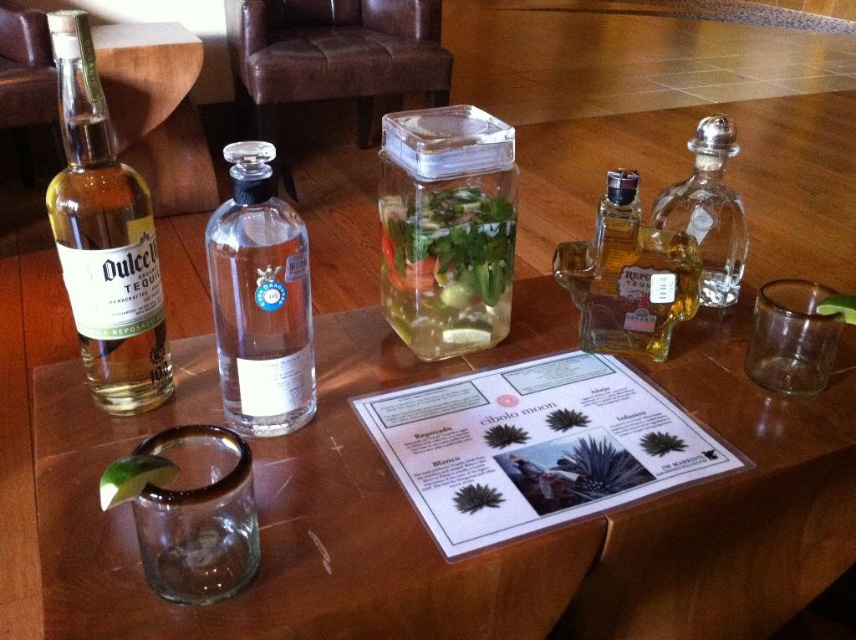
Question: Can you confirm if clear glass container at center is positioned to the left of clear glass bottle at upper right?

Choices:
 (A) yes
 (B) no

Answer: (A)

Question: Which is nearer to the clear glass bottle at center?

Choices:
 (A) clear glass bottle at upper right
 (B) translucent glass tequila bottle at center-right

Answer: (B)

Question: Which of the following is the closest to the observer?

Choices:
 (A) clear glass bottle at center
 (B) clear glass bottle at upper right
 (C) clear glass menu at center

Answer: (C)

Question: Which is farther from the clear glass container at center?

Choices:
 (A) translucent glass tequila bottle at center-right
 (B) clear glass bottle at upper right

Answer: (B)

Question: Is translucent glass tequila bottle at center-right to the left of clear glass bottle at upper right from the viewer's perspective?

Choices:
 (A) no
 (B) yes

Answer: (B)

Question: Is clear glass container at center to the left of translucent glass tequila bottle at center-right from the viewer's perspective?

Choices:
 (A) no
 (B) yes

Answer: (B)